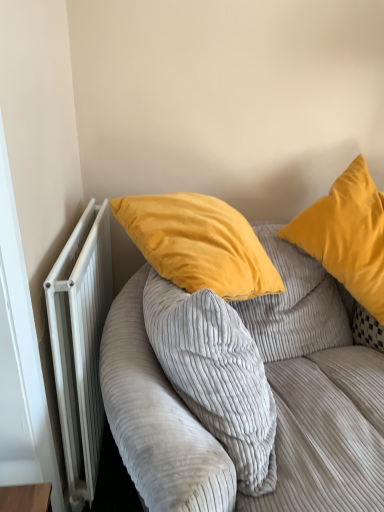
Question: Should I look upward or downward to see corduroy fabric couch at upper right?

Choices:
 (A) down
 (B) up

Answer: (A)

Question: Could you tell me if velvet yellow pillow at upper right is turned towards white metallic radiator at left?

Choices:
 (A) no
 (B) yes

Answer: (A)

Question: Can white metallic radiator at left be found inside velvet yellow pillow at upper right?

Choices:
 (A) yes
 (B) no

Answer: (B)

Question: Is velvet yellow pillow at upper right outside white metallic radiator at left?

Choices:
 (A) no
 (B) yes

Answer: (B)

Question: Can you confirm if velvet yellow pillow at upper right is wider than white metallic radiator at left?

Choices:
 (A) no
 (B) yes

Answer: (B)

Question: Considering the relative sizes of velvet yellow pillow at upper right and white metallic radiator at left in the image provided, is velvet yellow pillow at upper right taller than white metallic radiator at left?

Choices:
 (A) yes
 (B) no

Answer: (B)

Question: Is the depth of velvet yellow pillow at upper right less than that of white metallic radiator at left?

Choices:
 (A) yes
 (B) no

Answer: (B)

Question: Is corduroy fabric couch at upper right positioned with its back to white metallic radiator at left?

Choices:
 (A) no
 (B) yes

Answer: (A)

Question: Is corduroy fabric couch at upper right thinner than white metallic radiator at left?

Choices:
 (A) yes
 (B) no

Answer: (B)

Question: From the image's perspective, would you say corduroy fabric couch at upper right is shown under white metallic radiator at left?

Choices:
 (A) no
 (B) yes

Answer: (B)

Question: Can you confirm if corduroy fabric couch at upper right is taller than white metallic radiator at left?

Choices:
 (A) yes
 (B) no

Answer: (A)

Question: Would you say corduroy fabric couch at upper right is outside white metallic radiator at left?

Choices:
 (A) no
 (B) yes

Answer: (B)

Question: Does corduroy fabric couch at upper right lie in front of white metallic radiator at left?

Choices:
 (A) yes
 (B) no

Answer: (A)

Question: Considering the relative sizes of velvet yellow pillow at upper right and corduroy fabric couch at upper right in the image provided, is velvet yellow pillow at upper right smaller than corduroy fabric couch at upper right?

Choices:
 (A) no
 (B) yes

Answer: (B)